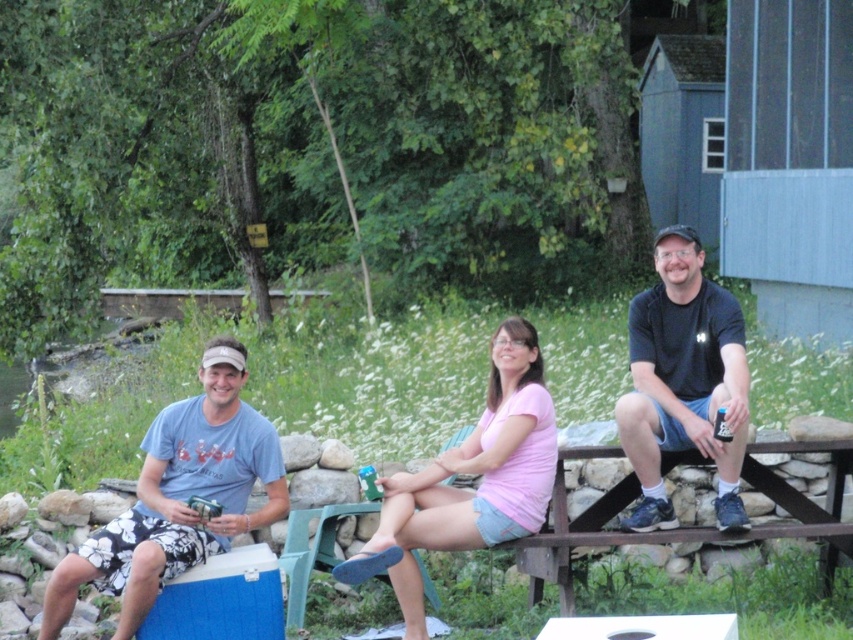
Question: Can you confirm if blue cotton shirt at left is thinner than black matte shirt at center?

Choices:
 (A) no
 (B) yes

Answer: (A)

Question: Among these points, which one is nearest to the camera?

Choices:
 (A) (x=418, y=497)
 (B) (x=701, y=342)

Answer: (A)

Question: Which of these objects is positioned farthest from the pink cotton shirt at center?

Choices:
 (A) blue cotton shirt at left
 (B) black matte shirt at center

Answer: (A)

Question: Which object is the farthest from the black matte shirt at center?

Choices:
 (A) pink cotton shirt at center
 (B) blue cotton shirt at left

Answer: (B)

Question: Can you confirm if blue cotton shirt at left is thinner than pink cotton shirt at center?

Choices:
 (A) no
 (B) yes

Answer: (A)

Question: Can you confirm if black matte shirt at center is thinner than pink cotton shirt at center?

Choices:
 (A) yes
 (B) no

Answer: (A)